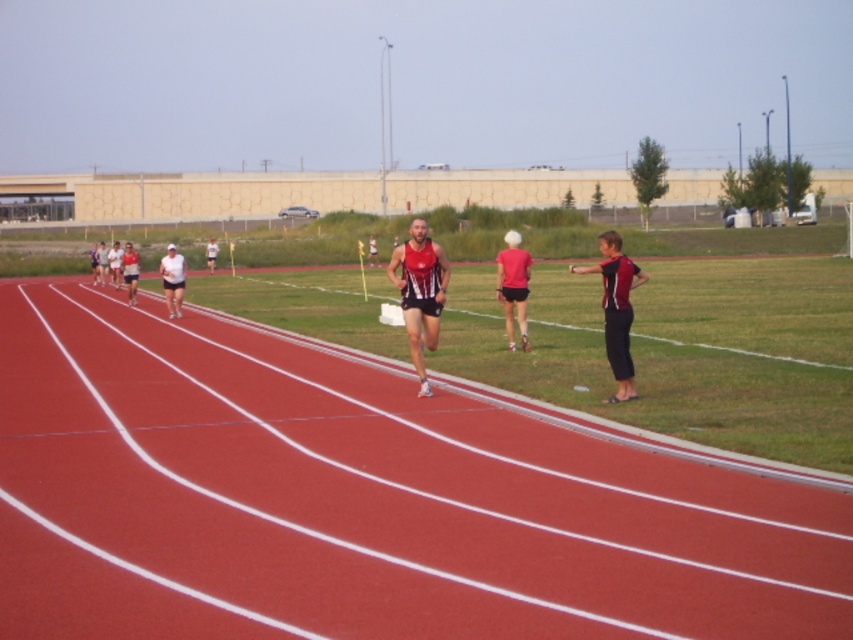
You are a photographer positioned at the edge of the rubberized red track at center. You want to capture a photo of the matte white shirt at left without including the track in the frame. Is the width of the track wider than the shirt?

The rubberized red track at center is wider than the matte white shirt at left, so the photographer cannot capture the matte white shirt at left without including the track in the frame because the track is wider.

You are a photographer positioned at the starting line of the race. You want to capture a photo of the matte red running suit at center without the matte pink shirt at center appearing in the background. Is this possible based on their current positions?

The matte red running suit at center is in front of the matte pink shirt at center, so yes, the photographer can capture a photo of the matte red running suit at center without the matte pink shirt at center in the background by focusing on the foreground subject.